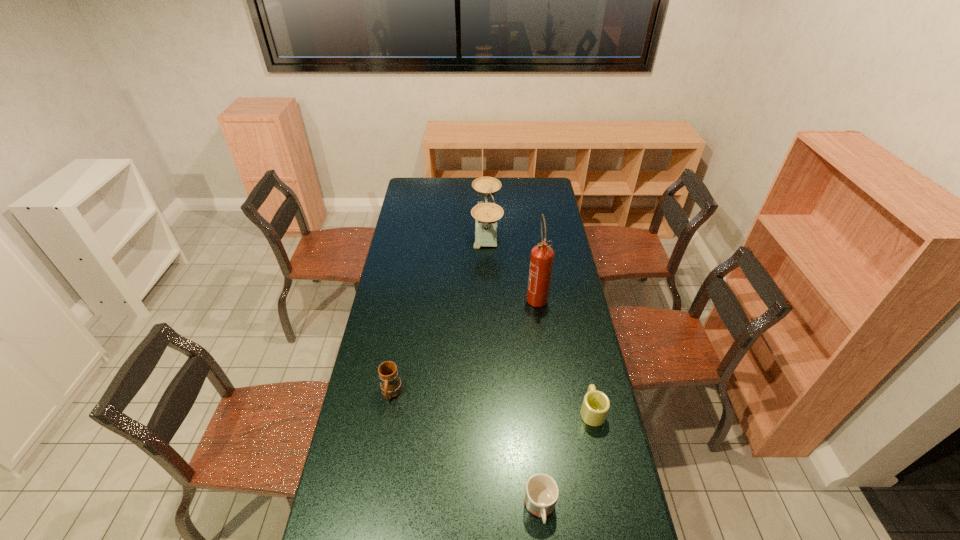
You are a GUI agent. You are given a task and a screenshot of the screen. Output one action in this format:
    pyautogui.click(x=<x>, y=<y>)
    Task: Click on the tallest object
    This screenshot has height=540, width=960.
    Given the screenshot: What is the action you would take?
    pyautogui.click(x=541, y=261)

In order to click on fire extinguisher in this screenshot , I will do `click(541, 261)`.

In order to click on the fourth shortest object in this screenshot , I will do (x=486, y=214).

Locate an element on the screen. the farthest object is located at coordinates point(486,214).

Identify the location of the leftmost object. The image size is (960, 540). (391, 386).

The height and width of the screenshot is (540, 960). Identify the location of the leftmost mug. (391, 386).

The width and height of the screenshot is (960, 540). In order to click on the rightmost object in this screenshot , I will do coord(596,404).

At what (x,y) coordinates should I click in order to perform the action: click on the nearest object. Please return your answer as a coordinate pair (x, y). The image size is (960, 540). Looking at the image, I should click on (541, 494).

I want to click on the nearest mug, so click(541, 494).

At what (x,y) coordinates should I click in order to perform the action: click on vacant region located from the nozzle of the fourth nearest object. Please return your answer as a coordinate pair (x, y). The image size is (960, 540). Looking at the image, I should click on (540, 321).